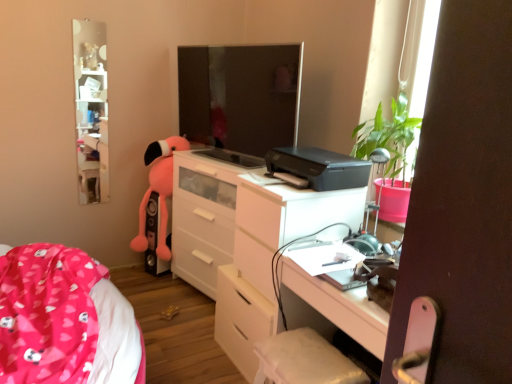
Question: Could white fabric swivel chair at lower center be considered to be inside black plastic printer at center?

Choices:
 (A) no
 (B) yes

Answer: (A)

Question: Is black plastic printer at center further to the viewer compared to white fabric swivel chair at lower center?

Choices:
 (A) no
 (B) yes

Answer: (B)

Question: Does black plastic printer at center have a greater height compared to white fabric swivel chair at lower center?

Choices:
 (A) yes
 (B) no

Answer: (B)

Question: From the image's perspective, does black plastic printer at center appear lower than white fabric swivel chair at lower center?

Choices:
 (A) no
 (B) yes

Answer: (A)

Question: Would you consider black plastic printer at center to be distant from white fabric swivel chair at lower center?

Choices:
 (A) yes
 (B) no

Answer: (B)

Question: In terms of width, does matte black monitor at center look wider or thinner when compared to black plastic printer at center?

Choices:
 (A) thin
 (B) wide

Answer: (A)

Question: From a real-world perspective, is matte black monitor at center physically located above or below black plastic printer at center?

Choices:
 (A) below
 (B) above

Answer: (B)

Question: Looking at the image, does matte black monitor at center seem bigger or smaller compared to black plastic printer at center?

Choices:
 (A) big
 (B) small

Answer: (A)

Question: From the image's perspective, relative to black plastic printer at center, is matte black monitor at center above or below?

Choices:
 (A) above
 (B) below

Answer: (A)

Question: Considering the positions of white glossy chest of drawers at center and black plastic printer at center in the image, is white glossy chest of drawers at center bigger or smaller than black plastic printer at center?

Choices:
 (A) big
 (B) small

Answer: (A)

Question: Considering the relative positions of white glossy chest of drawers at center and black plastic printer at center in the image provided, is white glossy chest of drawers at center to the left or to the right of black plastic printer at center?

Choices:
 (A) right
 (B) left

Answer: (B)

Question: Is white glossy chest of drawers at center in front of or behind black plastic printer at center in the image?

Choices:
 (A) front
 (B) behind

Answer: (B)

Question: In terms of height, does white glossy chest of drawers at center look taller or shorter compared to black plastic printer at center?

Choices:
 (A) tall
 (B) short

Answer: (A)

Question: Is point (285, 117) closer or farther from the camera than point (159, 140)?

Choices:
 (A) farther
 (B) closer

Answer: (B)

Question: Relative to pink plush toy at left, is matte black monitor at center in front or behind?

Choices:
 (A) front
 (B) behind

Answer: (A)